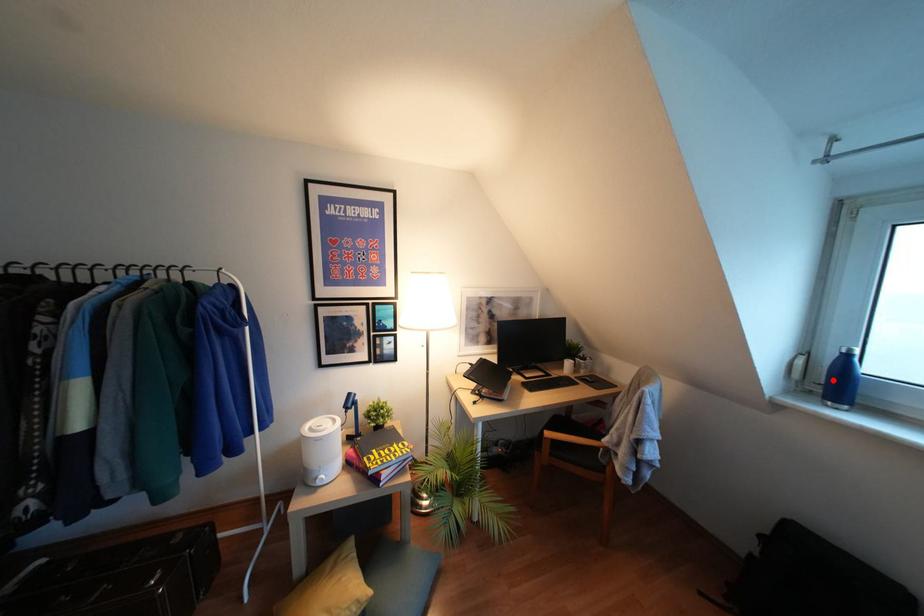
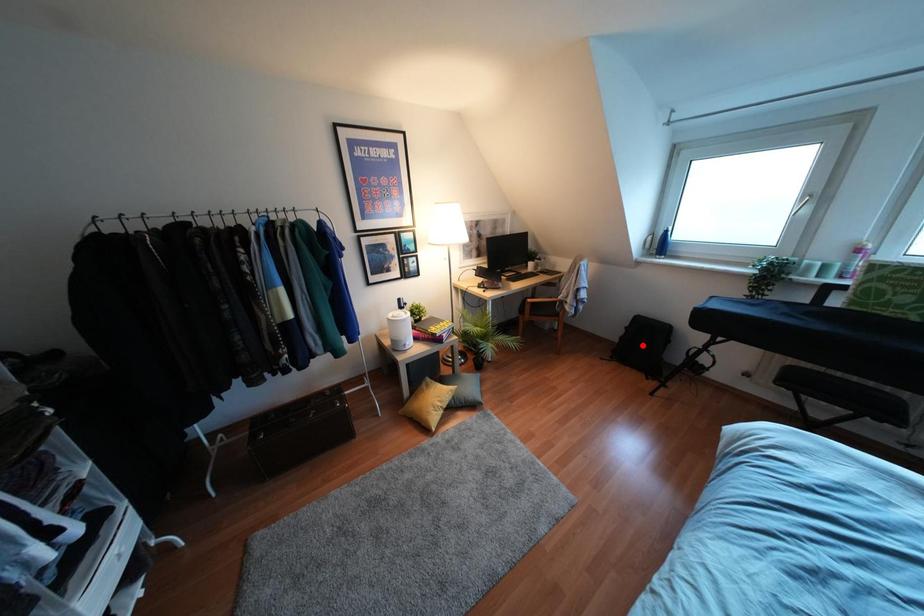
I am providing you with two images of the same scene from different viewpoints. A red point is marked on the first image and another point is marked on the second image. Is the marked point in image1 the same physical position as the marked point in image2?

No